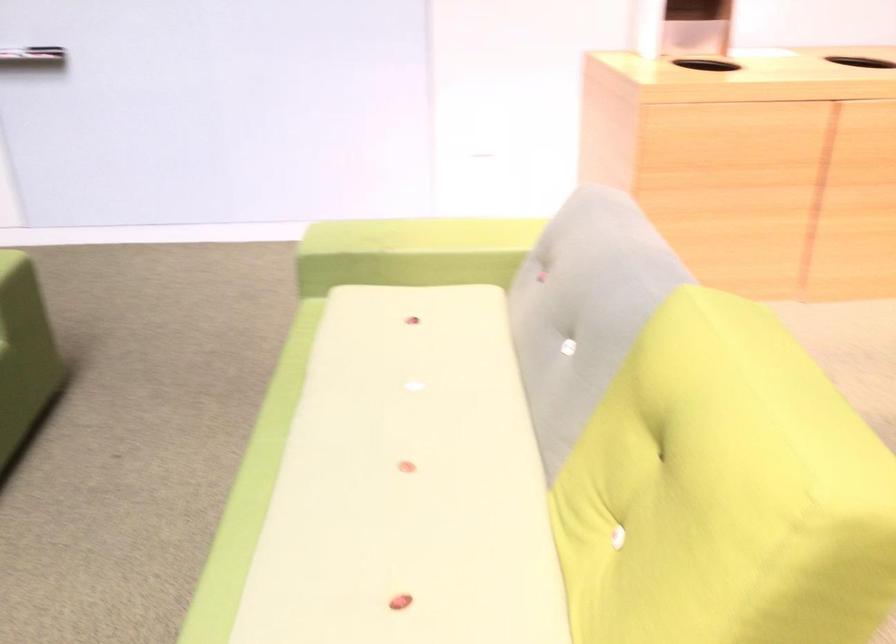
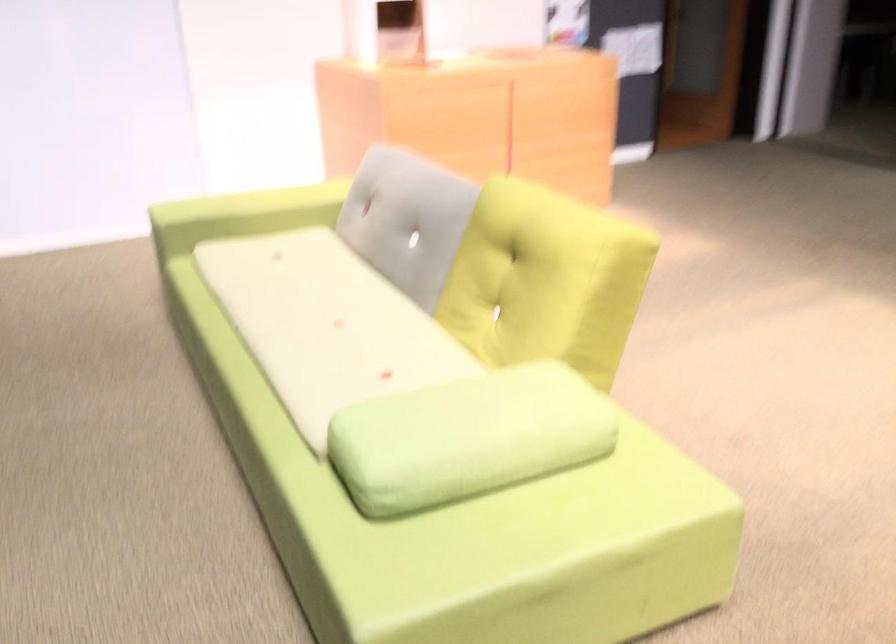
Question: Based on the continuous images, in which direction is the camera rotating? Reply with the corresponding letter.

Choices:
 (A) Left
 (B) Right
 (C) Up
 (D) Down

Answer: (B)